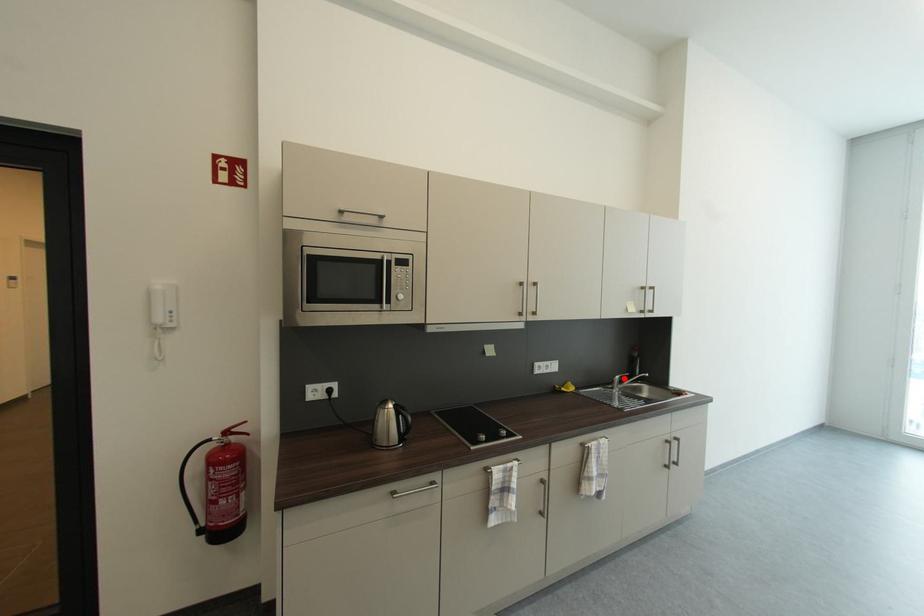
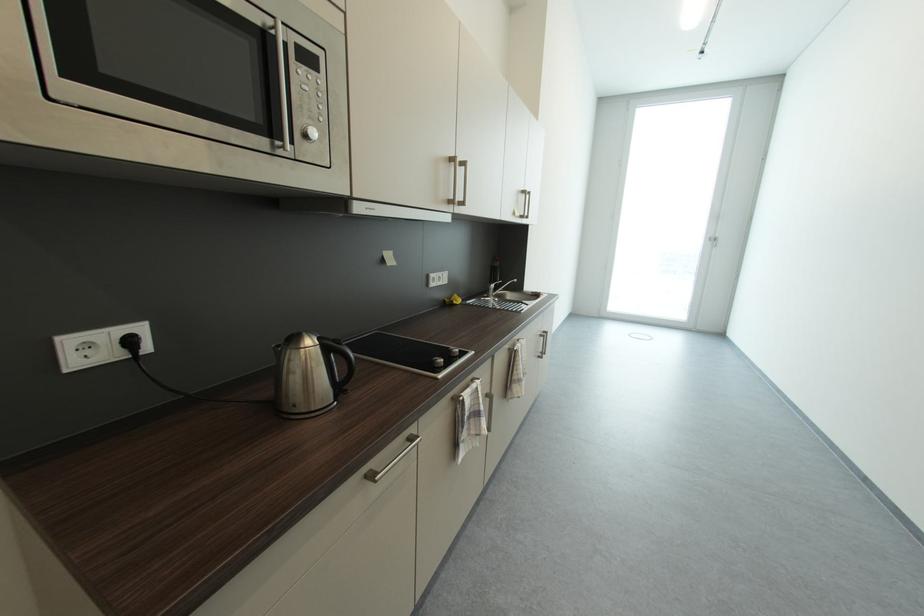
Find the pixel in the second image that matches the highlighted location in the first image.

(499, 286)